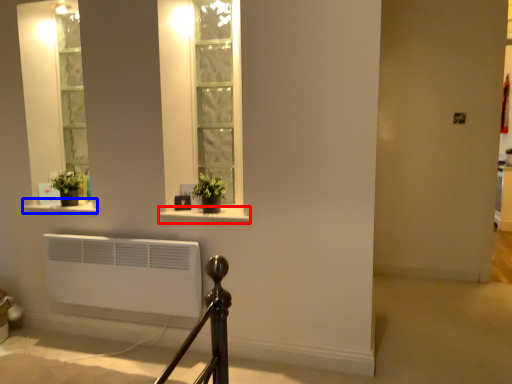
Question: Which object is closer to the camera taking this photo, window sill (highlighted by a red box) or window sill (highlighted by a blue box)?

Choices:
 (A) window sill
 (B) window sill

Answer: (A)